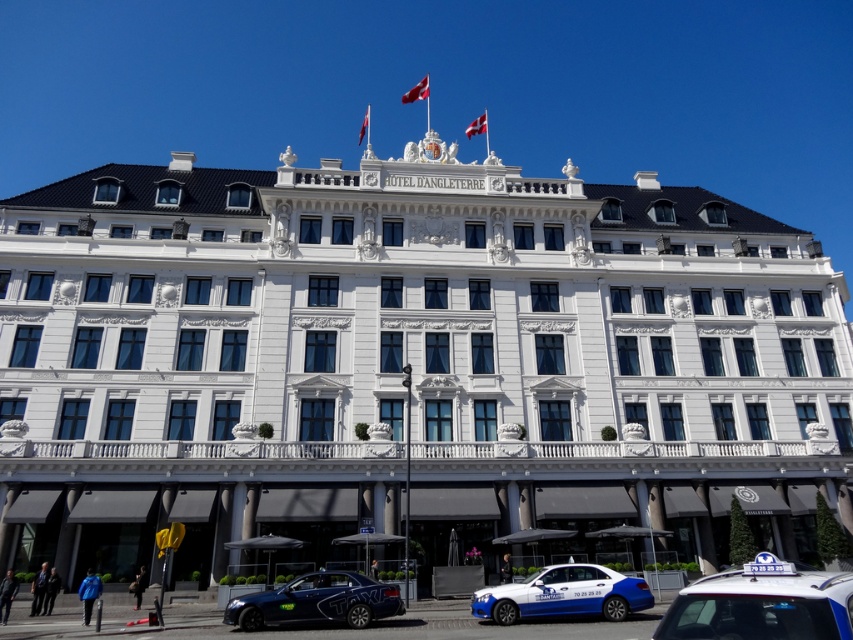
You are standing at the entrance of the grand building and want to walk towards the point that is closer to the decorative crest on the roof. Which point should you head towards, point [770,620] or point [338,570]?

Point [770,620] is in front of point [338,570], so it is closer to the decorative crest on the roof. You should head towards point [770,620].